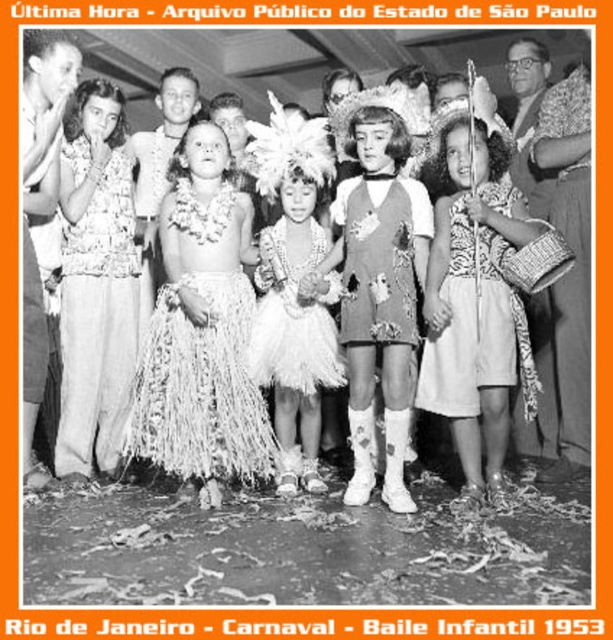
Can you confirm if white grass skirt at center is positioned above printed fabric dress at center?

Yes.

Is white grass skirt at center shorter than printed fabric dress at center?

Correct, white grass skirt at center is not as tall as printed fabric dress at center.

Locate an element on the screen. The width and height of the screenshot is (613, 640). white grass skirt at center is located at coordinates (294, 77).

Can you confirm if natural fiber skirt at center is taller than feathered headdress at center?

Correct, natural fiber skirt at center is much taller as feathered headdress at center.

The width and height of the screenshot is (613, 640). In order to click on natural fiber skirt at center in this screenshot , I will do `click(200, 387)`.

Does white feathered headdress at center have a greater width compared to printed fabric dress at center?

Yes, white feathered headdress at center is wider than printed fabric dress at center.

Between point (300, 211) and point (346, 208), which one is positioned behind?

Positioned behind is point (300, 211).

Does point (316, 387) come closer to viewer compared to point (394, 336)?

No.

Where is `white feathered headdress at center`? Image resolution: width=613 pixels, height=640 pixels. white feathered headdress at center is located at coordinates (294, 292).